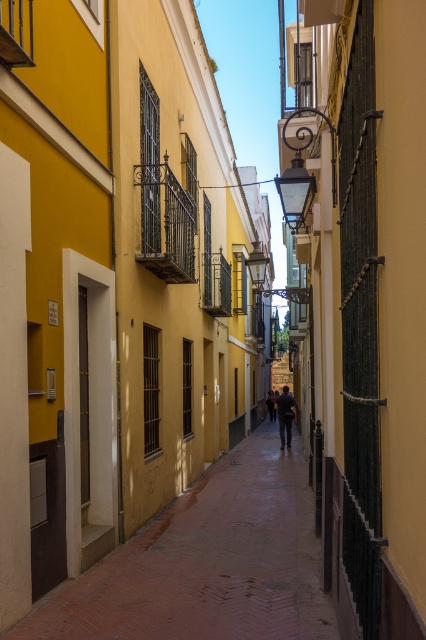
Between brick paved path at center and dark blue jeans at center, which one is positioned lower?

dark blue jeans at center is lower down.

What do you see at coordinates (207, 563) in the screenshot? I see `brick paved path at center` at bounding box center [207, 563].

What are the coordinates of `brick paved path at center` in the screenshot? It's located at (207, 563).